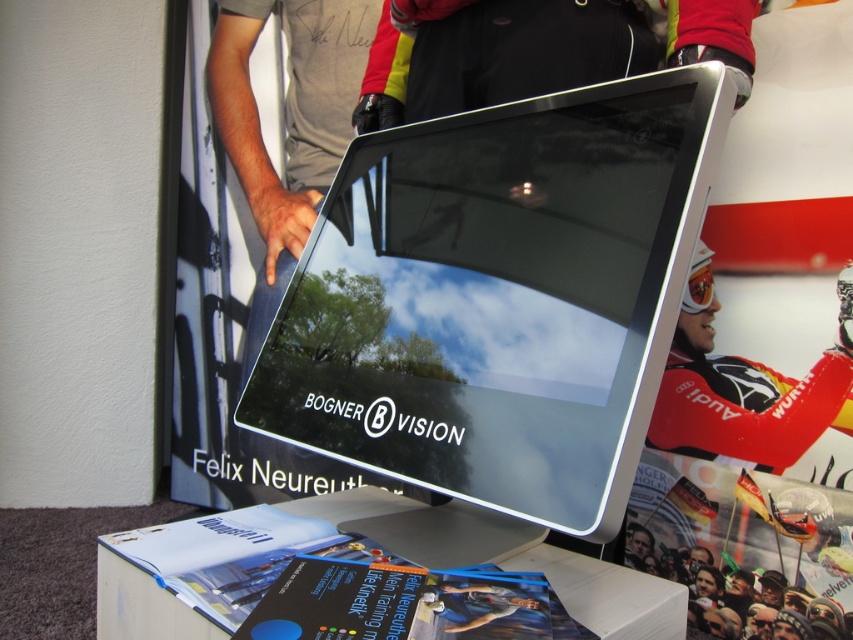
The image size is (853, 640). What do you see at coordinates (498, 298) in the screenshot?
I see `sleek silver monitor at center` at bounding box center [498, 298].

Does sleek silver monitor at center come in front of white plastic table at lower center?

No, it is not.

Is point (426, 196) behind point (679, 605)?

Yes.

Locate an element on the screen. sleek silver monitor at center is located at coordinates point(498,298).

How far apart are white plastic table at lower center and red matte skier at center?

white plastic table at lower center is 29.14 inches away from red matte skier at center.

Is white plastic table at lower center to the right of red matte skier at center from the viewer's perspective?

No, white plastic table at lower center is not to the right of red matte skier at center.

Where is `white plastic table at lower center`? This screenshot has width=853, height=640. white plastic table at lower center is located at coordinates (380, 545).

How far apart are sleek silver monitor at center and red matte skier at center?

A distance of 77.23 centimeters exists between sleek silver monitor at center and red matte skier at center.

Can you confirm if sleek silver monitor at center is thinner than red matte skier at center?

No, sleek silver monitor at center is not thinner than red matte skier at center.

Is point (561, 92) farther from camera compared to point (706, 433)?

No, (561, 92) is in front of (706, 433).

Find the location of a particular element. sleek silver monitor at center is located at coordinates (498, 298).